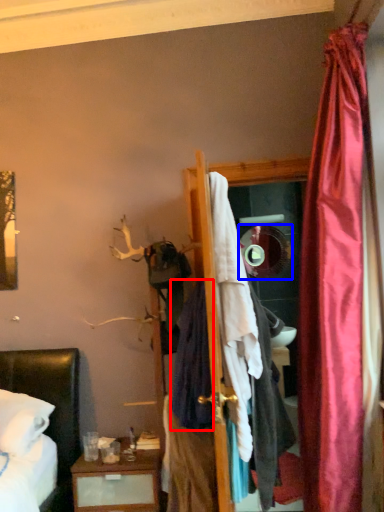
Question: Which object is further to the camera taking this photo, clothing (highlighted by a red box) or mirror (highlighted by a blue box)?

Choices:
 (A) clothing
 (B) mirror

Answer: (B)